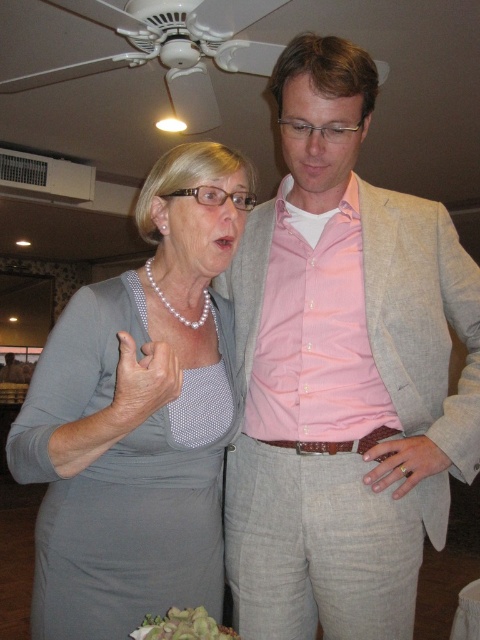
You are organizing a charity event and need to arrange two items on a table. The pink linen suit at center and the green leafy salad at lower center must be placed side by side. Which item requires more horizontal space to accommodate its width?

The pink linen suit at center requires more horizontal space because its width surpasses that of the green leafy salad at lower center.

You are at a social event and want to compliment someone on their outfit. You notice the pink linen suit at center and the pearl necklace at center. Which one is located lower on the person?

The pink linen suit at center is positioned under the pearl necklace at center, so it is located lower on the person.

You are at a social event and see two people standing in front of you. The first person is pointing at point (x=351, y=51) and the second person is pointing at point (x=219, y=534). Which point is closer to you?

Point (x=351, y=51) is in front of point (x=219, y=534), so it is closer to you.